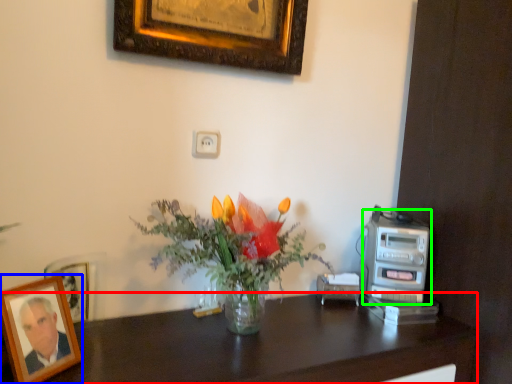
Question: Which is farther away from desk (highlighted by a red box)? picture frame (highlighted by a blue box) or appliance (highlighted by a green box)?

Choices:
 (A) picture frame
 (B) appliance

Answer: (A)